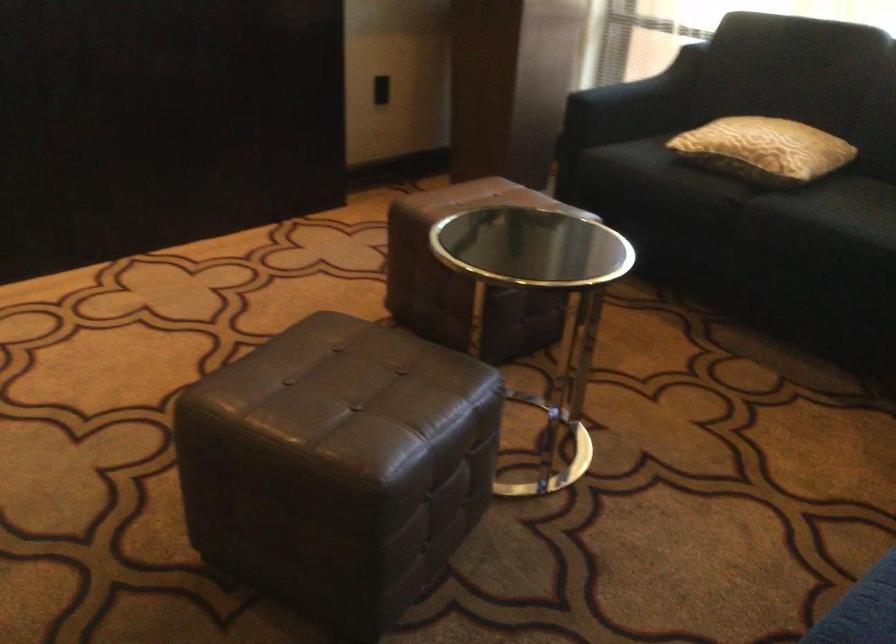
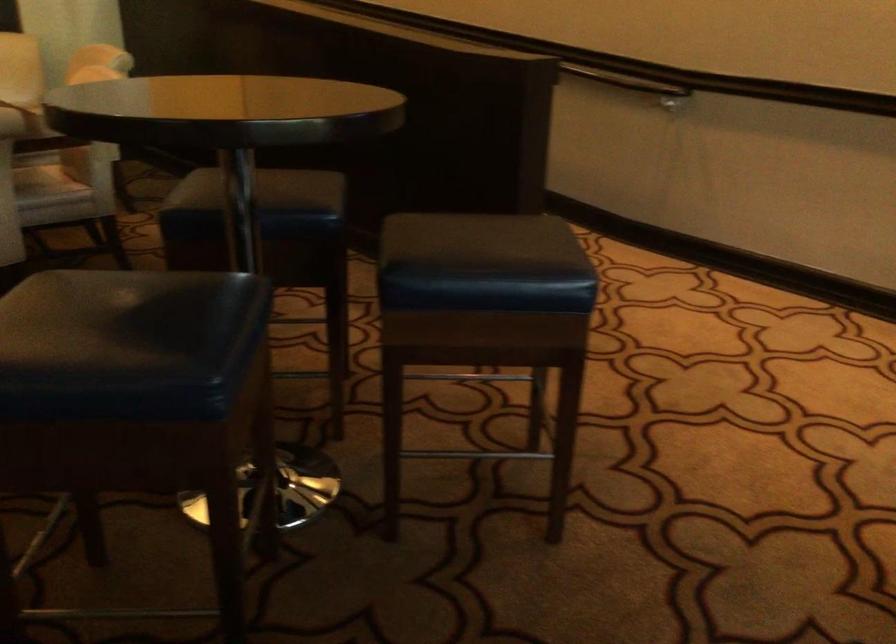
Based on the continuous images, in which direction is the camera rotating?

The camera rotated toward left-down.